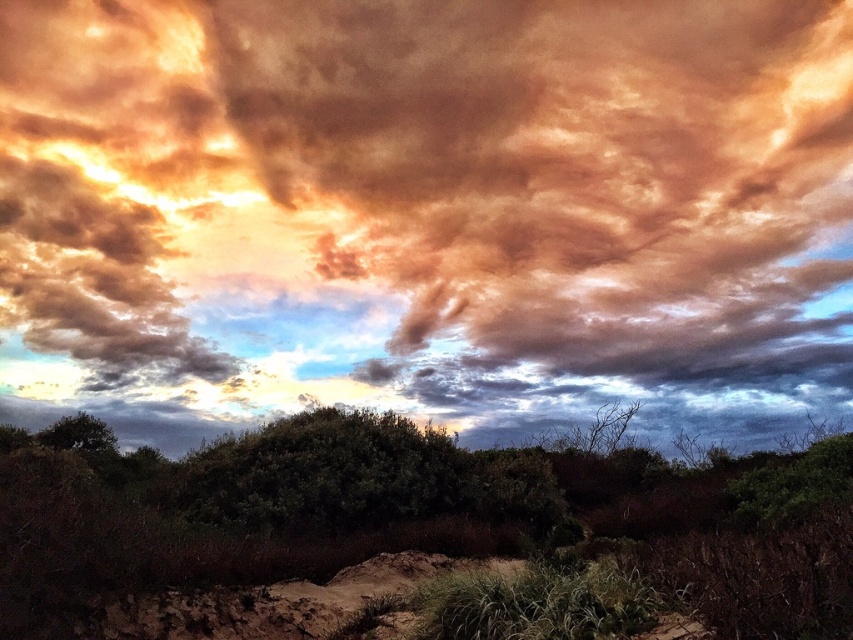
You are standing at the base of the mountain and want to reach the point marked as point (780, 276). If your current elevation is 100 meters above sea level and the point is at 125.6 meters, will you need to climb uphill?

Yes, you will need to climb uphill because the point (780, 276) is at 125.6 meters, which is higher than your current elevation of 100 meters.

You are standing on the dry soil in the foreground and want to place a small weather station between the matte orange cloud at upper center and the green matte shrubs at center. Since the weather station requires a 3 meter gap between it and any object, is this possible?

The distance between the matte orange cloud at upper center and the green matte shrubs at center is 8.76 meters. Subtracting the required 3 meter gaps on both sides, the weather station can be placed in the remaining 2.76 meters between them. However, since the total distance allows for the 3 meter buffer on both ends, it is possible to position the weather station appropriately.

You are a pilot flying a small airplane and need to navigate between the matte orange cloud at upper center and the green matte shrubs at center. Can you safely pass between them vertically?

The matte orange cloud at upper center is much taller than the green matte shrubs at center, so yes, there is enough vertical space to safely pass between them.